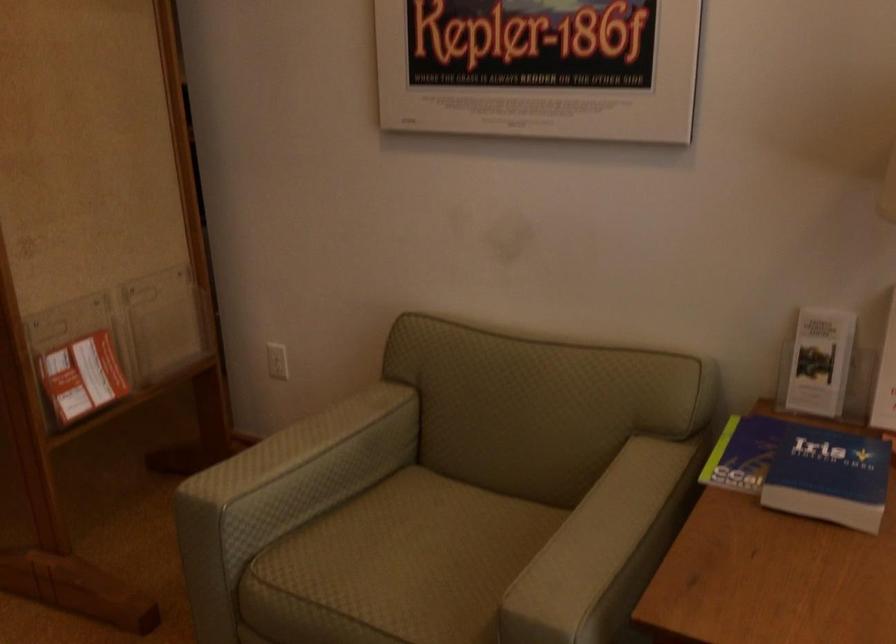
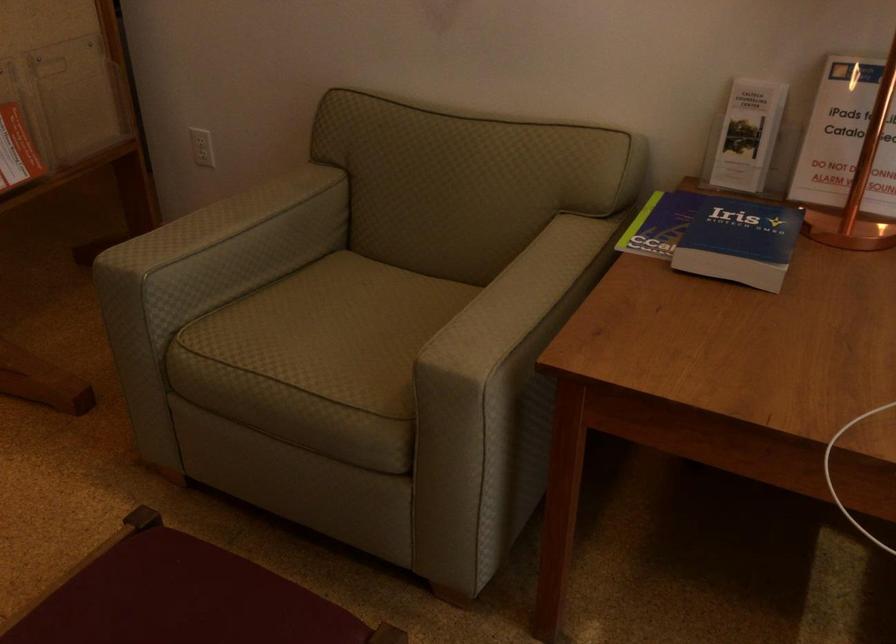
Find the pixel in the second image that matches pixel 277 363 in the first image.

(202, 147)